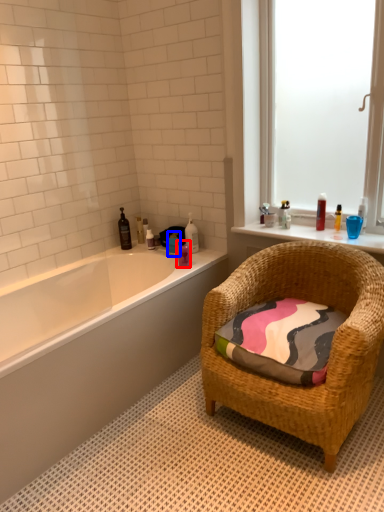
Question: Which object appears farthest to the camera in this image, toiletry (highlighted by a red box) or toiletry (highlighted by a blue box)?

Choices:
 (A) toiletry
 (B) toiletry

Answer: (B)